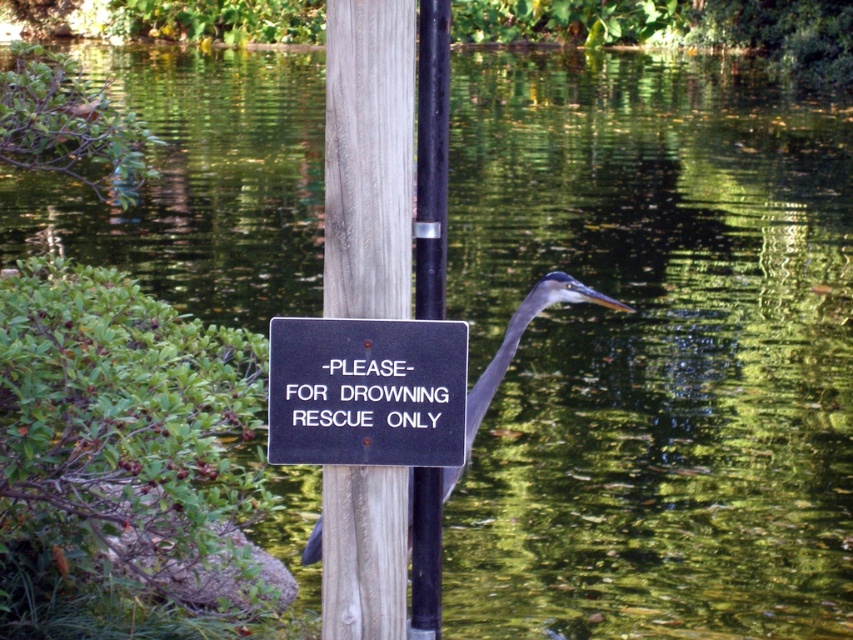
You are standing at the edge of the water and want to place a small buoy at the point marked by the coordinates point (368, 157). Based on the scene, where exactly on the wooden post at center would this buoy be placed?

The point (368, 157) is located on the wooden post at center, so the buoy should be placed there.

You are standing at the center of the image. Which direction should you move to reach the wooden post at center?

The wooden post at center is already at the center of the image, so you don not need to move in any direction to reach it.